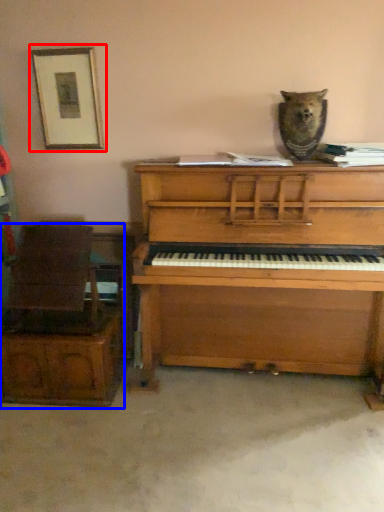
Question: Which of the following is the farthest to the observer, picture frame (highlighted by a red box) or furniture (highlighted by a blue box)?

Choices:
 (A) picture frame
 (B) furniture

Answer: (A)